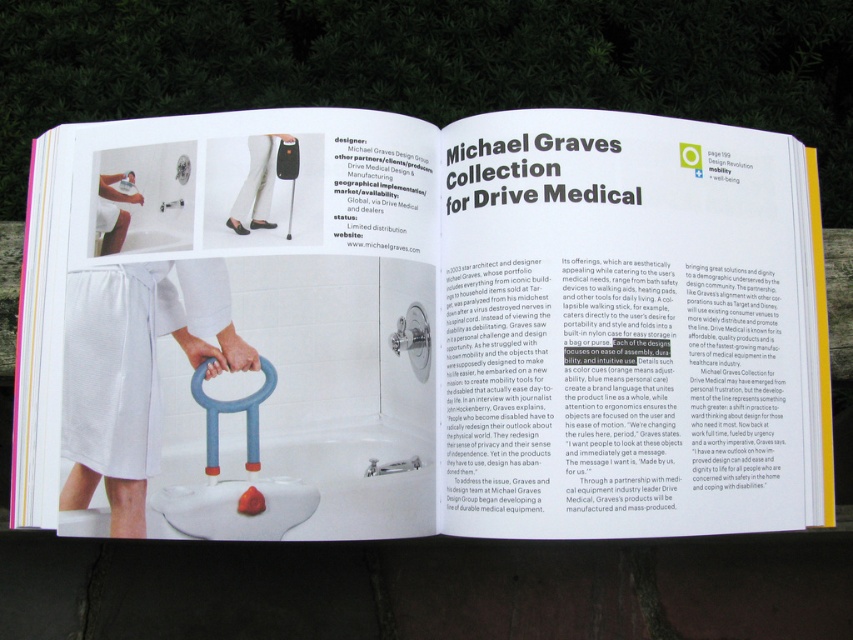
Is white textured towel at lower left wider than white matte leg at upper center?

Yes.

Does white textured towel at lower left have a lesser width compared to white matte leg at upper center?

In fact, white textured towel at lower left might be wider than white matte leg at upper center.

Does point (97, 435) lie in front of point (276, 138)?

Yes, it is in front of point (276, 138).

This screenshot has height=640, width=853. Find the location of `white textured towel at lower left`. white textured towel at lower left is located at coordinates (132, 371).

Does blue foam stool at lower center have a larger size compared to white matte towel at lower left?

Correct, blue foam stool at lower center is larger in size than white matte towel at lower left.

Does point (218, 468) come behind point (112, 180)?

No.

Image resolution: width=853 pixels, height=640 pixels. What are the coordinates of `blue foam stool at lower center` in the screenshot? It's located at (230, 412).

Identify the location of white plastic grab bar at lower center. This screenshot has width=853, height=640. (430, 328).

Can you confirm if white plastic grab bar at lower center is taller than blue foam stool at lower center?

Correct, white plastic grab bar at lower center is much taller as blue foam stool at lower center.

Does point (247, 484) come in front of point (273, 365)?

Yes, point (247, 484) is closer to viewer.

Locate an element on the screen. This screenshot has width=853, height=640. white plastic grab bar at lower center is located at coordinates (430, 328).